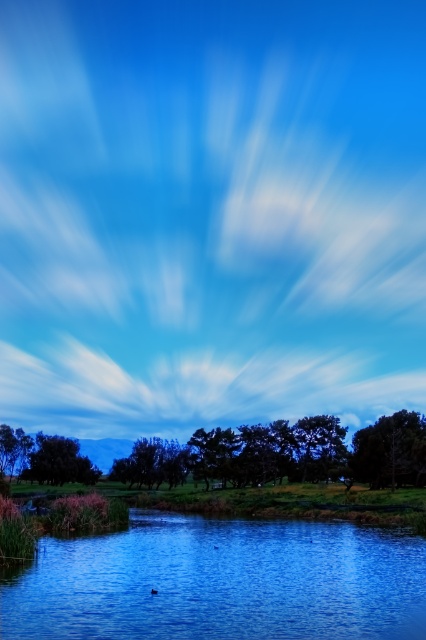
You are standing at the point labeled as point (221, 582) in the image. What is the surface you are currently standing on?

The point (221, 582) is on blue glassy river at lower center, so you are standing on the blue glassy river at lower center.

You are standing at the point with coordinates (221, 582) in the image. Based on the scene description, what object are you looking at?

The point at (221, 582) indicates the blue glassy river at lower center.